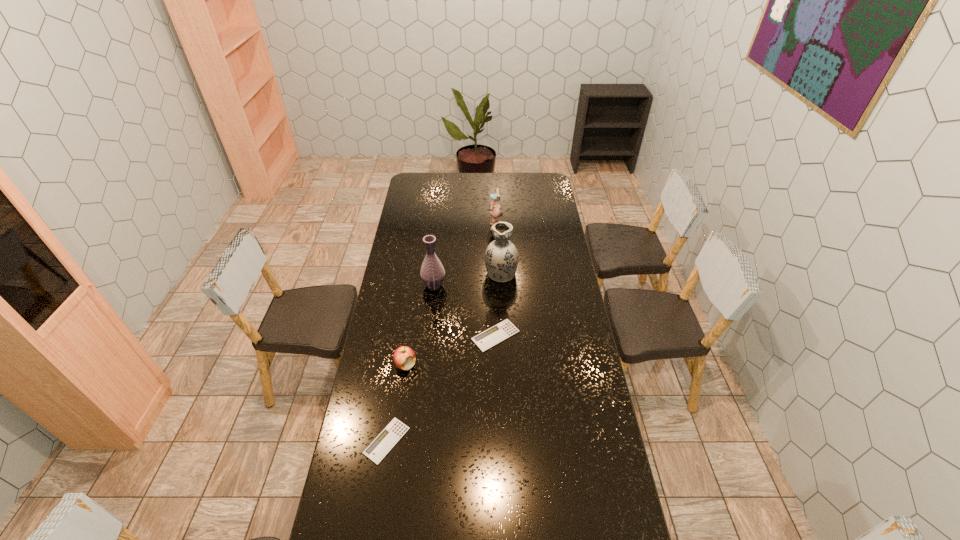
Where is `vacant space that satisfies the following two spatial constraints: 1. on the front-facing side of the fourth shortest object; 2. on the front side of the left vase`? The width and height of the screenshot is (960, 540). vacant space that satisfies the following two spatial constraints: 1. on the front-facing side of the fourth shortest object; 2. on the front side of the left vase is located at coordinates (498, 286).